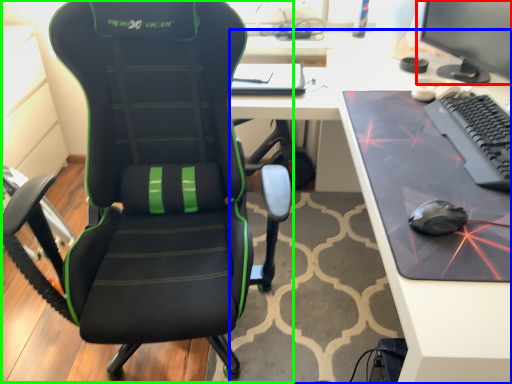
Question: Which is nearer to the computer monitor (highlighted by a red box)? desk (highlighted by a blue box) or chair (highlighted by a green box).

Choices:
 (A) desk
 (B) chair

Answer: (A)